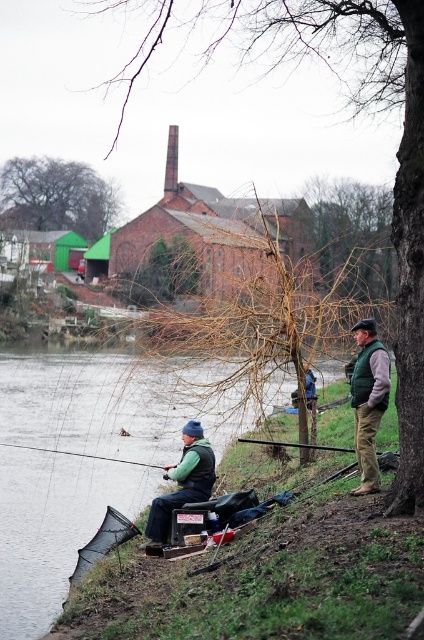
Can you confirm if matte green vest at center is positioned to the left of green plastic fishing pole at left?

No, matte green vest at center is not to the left of green plastic fishing pole at left.

Who is positioned more to the right, matte green vest at center or green plastic fishing pole at left?

Positioned to the right is matte green vest at center.

Where is `matte green vest at center`? Image resolution: width=424 pixels, height=640 pixels. matte green vest at center is located at coordinates (181, 483).

Who is higher up, green fabric vest at lower right or smooth black rod at lower center?

green fabric vest at lower right is higher up.

Who is lower down, green fabric vest at lower right or smooth black rod at lower center?

smooth black rod at lower center is below.

Is point (371, 417) farther from camera compared to point (323, 449)?

No.

What are the coordinates of `green fabric vest at lower right` in the screenshot? It's located at (368, 401).

In the scene shown: Can you confirm if green plastic fishing pole at left is positioned below smooth black rod at lower center?

Yes.

Between point (69, 452) and point (251, 438), which one is positioned in front?

Positioned in front is point (251, 438).

Where is `green plastic fishing pole at left`? This screenshot has height=640, width=424. green plastic fishing pole at left is located at coordinates (80, 454).